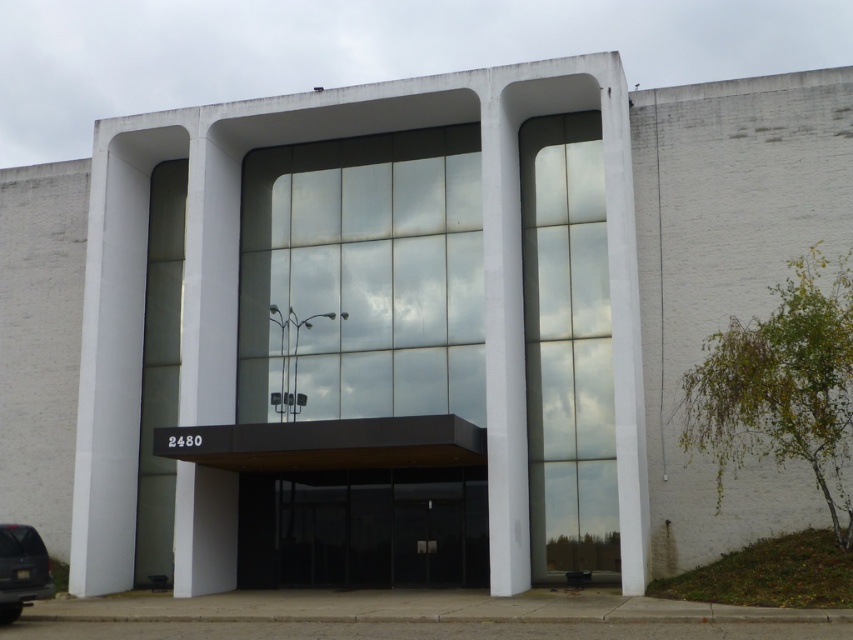
Question: Is transparent glass doors at center wider than shiny black suv at lower left?

Choices:
 (A) no
 (B) yes

Answer: (B)

Question: Can you confirm if transparent glass doors at center is bigger than shiny black suv at lower left?

Choices:
 (A) yes
 (B) no

Answer: (A)

Question: Which object appears closest to the camera in this image?

Choices:
 (A) shiny black suv at lower left
 (B) transparent glass doors at center

Answer: (A)

Question: Is transparent glass doors at center in front of shiny black suv at lower left?

Choices:
 (A) no
 (B) yes

Answer: (A)

Question: Which object is closer to the camera taking this photo?

Choices:
 (A) transparent glass doors at center
 (B) shiny black suv at lower left

Answer: (B)